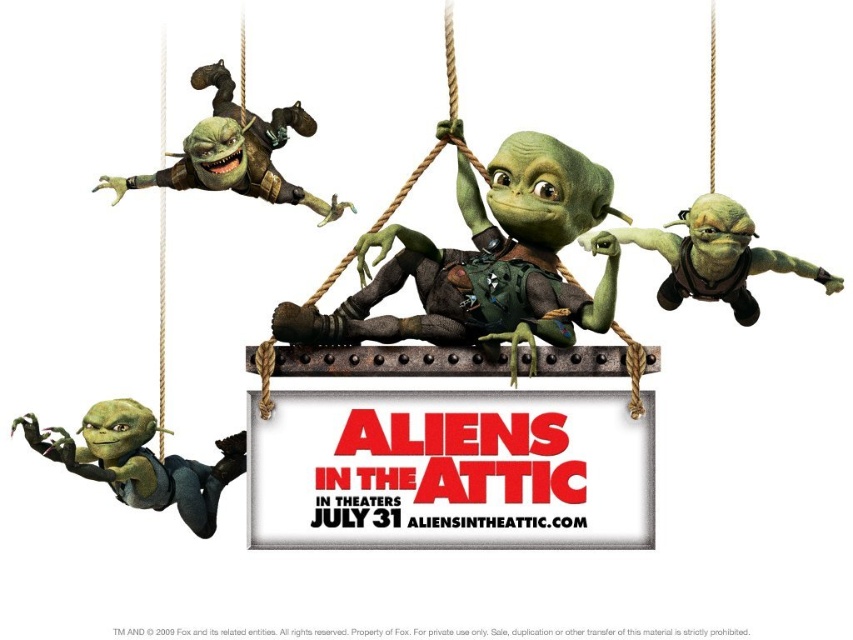
You are a moviegoer standing in front of the promotional poster for the movie. You want to touch the white cardboard sign at center and the matte green alien at center. Which object will you reach first?

The white cardboard sign at center is closer to you than the matte green alien at center, so you will reach the white cardboard sign at center first.